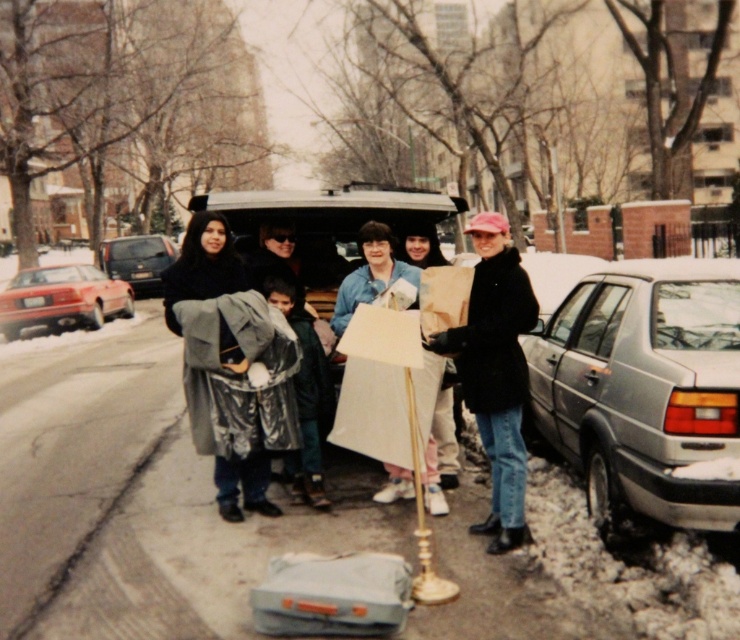
Between shiny red car at left and dark gray matte van at center, which one appears on the right side from the viewer's perspective?

shiny red car at left is more to the right.

Between point (61, 308) and point (101, 259), which one is positioned behind?

Point (101, 259)

What are the coordinates of `shiny red car at left` in the screenshot? It's located at click(x=61, y=298).

Which of these two, black fuzzy coat at center or shiny red car at left, stands taller?

With more height is black fuzzy coat at center.

Is point (477, 420) farther from viewer compared to point (41, 314)?

That is False.

Describe the element at coordinates (494, 371) in the screenshot. I see `black fuzzy coat at center` at that location.

Image resolution: width=740 pixels, height=640 pixels. In order to click on black fuzzy coat at center in this screenshot , I will do `click(494, 371)`.

Is silver metallic sedan at right closer to camera compared to black fuzzy coat at center?

Yes, it is.

Is point (659, 307) farther from viewer compared to point (500, 369)?

No.

The image size is (740, 640). What are the coordinates of `silver metallic sedan at right` in the screenshot? It's located at (645, 392).